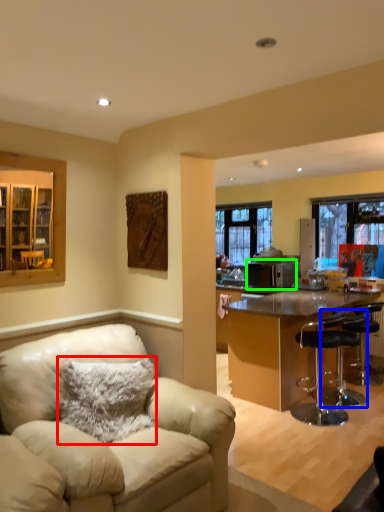
Question: Based on their relative distances, which object is nearer to pillow (highlighted by a red box)? Choose from chair (highlighted by a blue box) and appliance (highlighted by a green box).

Choices:
 (A) chair
 (B) appliance

Answer: (A)